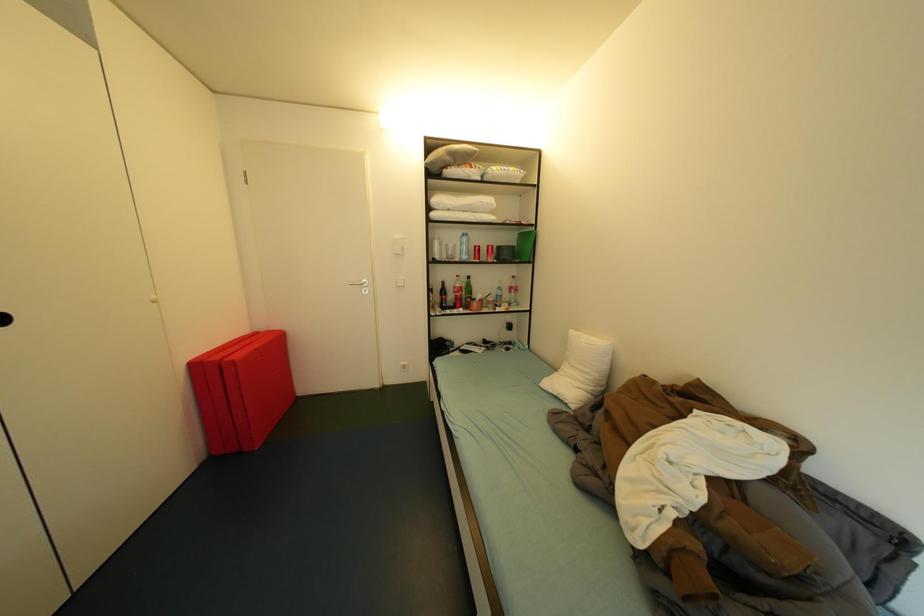
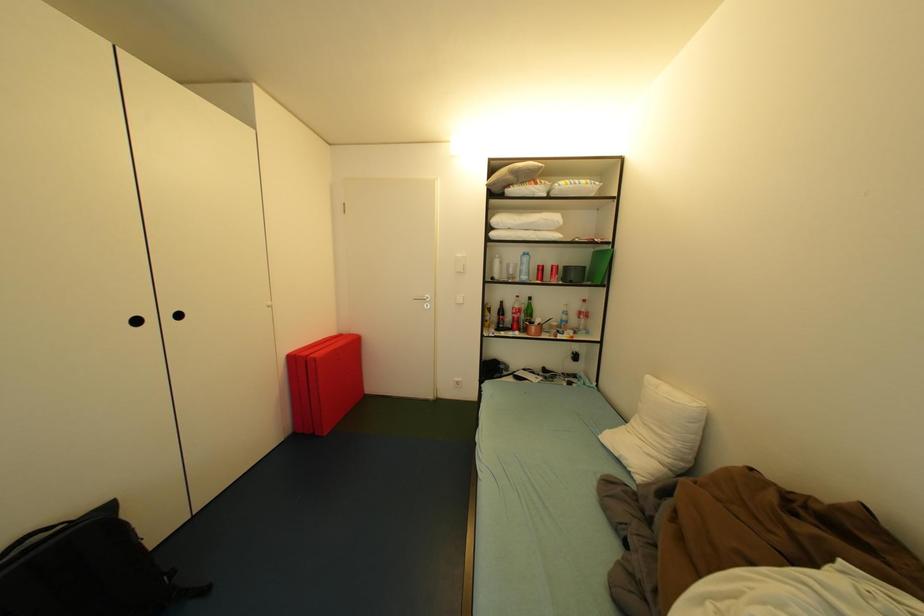
Question: The first image is from the beginning of the video and the second image is from the end. How did the camera likely rotate when shooting the video?

Choices:
 (A) Left
 (B) Right
 (C) Up
 (D) Down

Answer: (A)